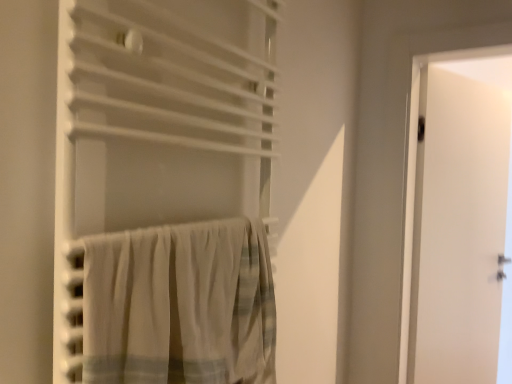
Question: From a real-world perspective, is white fabric curtain at center, which is counted as the 1th curtain, starting from the top, physically above white cotton curtain at lower left, arranged as the 2th curtain when viewed from the top?

Choices:
 (A) yes
 (B) no

Answer: (A)

Question: Is white fabric curtain at center, the 2th curtain positioned from the bottom, oriented away from white cotton curtain at lower left, arranged as the 2th curtain when viewed from the top?

Choices:
 (A) yes
 (B) no

Answer: (A)

Question: Considering the relative sizes of white fabric curtain at center, which is counted as the 1th curtain, starting from the top, and white cotton curtain at lower left, arranged as the 1th curtain when ordered from the bottom, in the image provided, is white fabric curtain at center, which is counted as the 1th curtain, starting from the top, wider than white cotton curtain at lower left, arranged as the 1th curtain when ordered from the bottom,?

Choices:
 (A) yes
 (B) no

Answer: (A)

Question: From the image's perspective, does white fabric curtain at center, the 2th curtain positioned from the bottom, appear lower than white cotton curtain at lower left, arranged as the 1th curtain when ordered from the bottom?

Choices:
 (A) no
 (B) yes

Answer: (A)

Question: Considering the relative sizes of white fabric curtain at center, the 2th curtain positioned from the bottom, and white cotton curtain at lower left, arranged as the 2th curtain when viewed from the top, in the image provided, is white fabric curtain at center, the 2th curtain positioned from the bottom, shorter than white cotton curtain at lower left, arranged as the 2th curtain when viewed from the top,?

Choices:
 (A) yes
 (B) no

Answer: (B)

Question: Visually, is white cotton curtain at lower left, arranged as the 1th curtain when ordered from the bottom, positioned to the left or to the right of white matte door at right?

Choices:
 (A) left
 (B) right

Answer: (A)

Question: In terms of size, does white cotton curtain at lower left, arranged as the 1th curtain when ordered from the bottom, appear bigger or smaller than white matte door at right?

Choices:
 (A) small
 (B) big

Answer: (A)

Question: From a real-world perspective, is white cotton curtain at lower left, arranged as the 1th curtain when ordered from the bottom, positioned above or below white matte door at right?

Choices:
 (A) above
 (B) below

Answer: (A)

Question: In the image, is white cotton curtain at lower left, arranged as the 2th curtain when viewed from the top, positioned in front of or behind white matte door at right?

Choices:
 (A) behind
 (B) front

Answer: (B)

Question: Is white fabric curtain at center, which is counted as the 1th curtain, starting from the top, taller or shorter than white matte door at right?

Choices:
 (A) short
 (B) tall

Answer: (A)

Question: Based on their positions, is white fabric curtain at center, which is counted as the 1th curtain, starting from the top, located to the left or right of white matte door at right?

Choices:
 (A) left
 (B) right

Answer: (A)

Question: Is white fabric curtain at center, the 2th curtain positioned from the bottom, inside the boundaries of white matte door at right, or outside?

Choices:
 (A) outside
 (B) inside

Answer: (A)

Question: From a real-world perspective, is white fabric curtain at center, the 2th curtain positioned from the bottom, above or below white matte door at right?

Choices:
 (A) above
 (B) below

Answer: (A)

Question: Would you say white cotton curtain at lower left, arranged as the 2th curtain when viewed from the top, is inside or outside white fabric curtain at center, the 2th curtain positioned from the bottom?

Choices:
 (A) inside
 (B) outside

Answer: (A)

Question: Looking at the image, does white cotton curtain at lower left, arranged as the 1th curtain when ordered from the bottom, seem bigger or smaller compared to white fabric curtain at center, which is counted as the 1th curtain, starting from the top?

Choices:
 (A) big
 (B) small

Answer: (B)